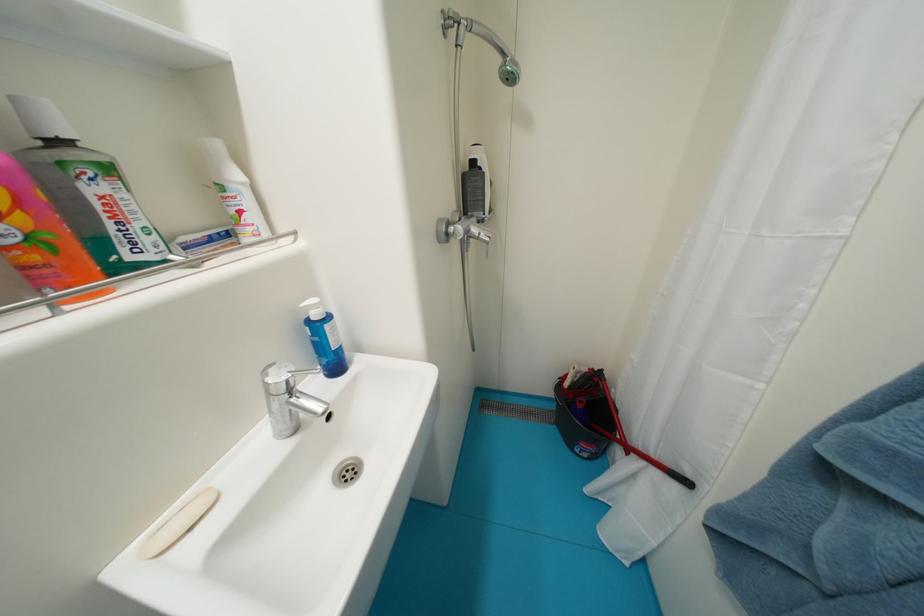
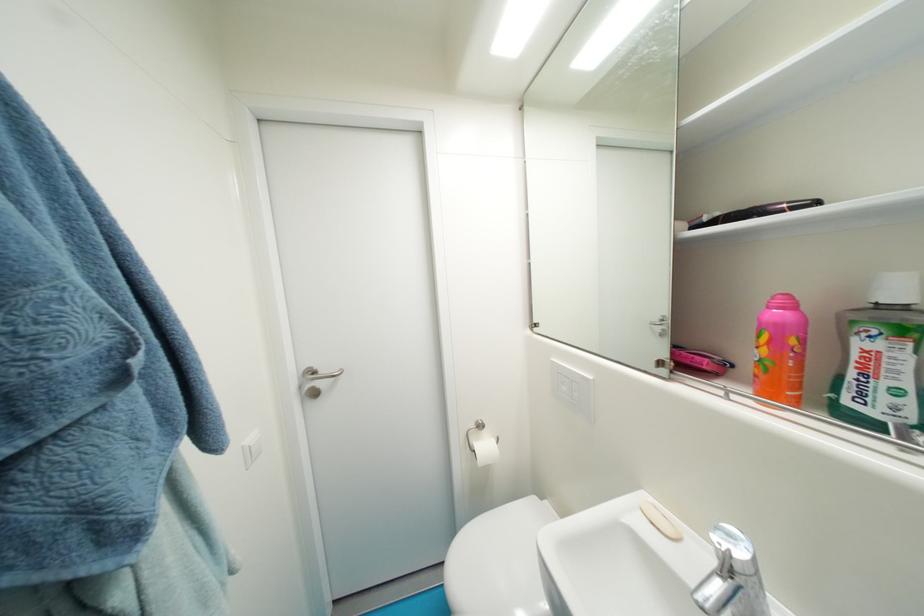
The point at (199,530) is marked in the first image. Where is the corresponding point in the second image?

(659, 525)